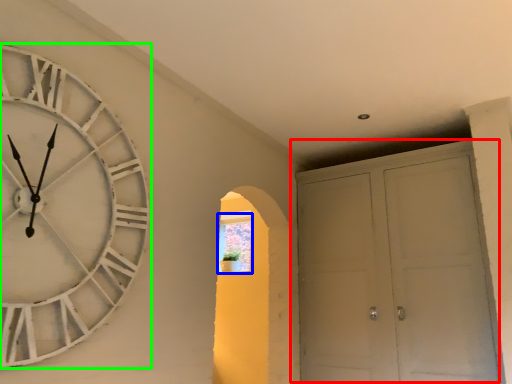
Question: Which object is the closest to the door (highlighted by a red box)? Choose among these: window (highlighted by a blue box) or wall clock (highlighted by a green box).

Choices:
 (A) window
 (B) wall clock

Answer: (A)